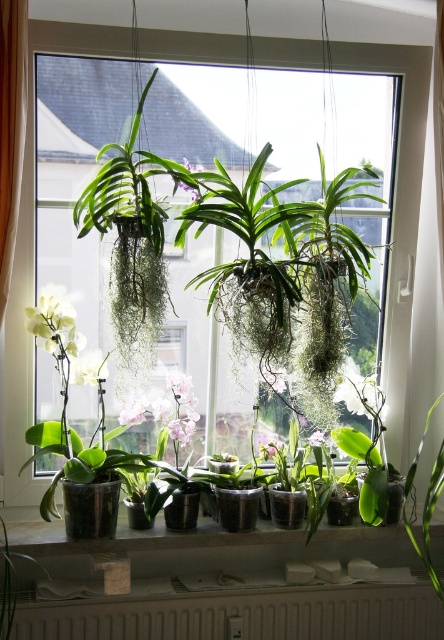
Question: Does white plastic radiator at lower center lie in front of white matte orchid at center?

Choices:
 (A) yes
 (B) no

Answer: (A)

Question: Does matte concrete window sill at lower center have a larger size compared to white matte orchid at center?

Choices:
 (A) yes
 (B) no

Answer: (A)

Question: Which point is closer to the camera taking this photo?

Choices:
 (A) (237, 596)
 (B) (63, 253)

Answer: (A)

Question: Which point is farther from the camera taking this photo?

Choices:
 (A) (380, 536)
 (B) (198, 172)
 (C) (12, 38)

Answer: (A)

Question: Can you confirm if transparent glass window at center is bigger than pink matte orchid at center?

Choices:
 (A) no
 (B) yes

Answer: (B)

Question: Estimate the real-world distances between objects in this image. Which object is farther from the pink matte orchid at center?

Choices:
 (A) white matte orchid at center
 (B) transparent glass window at center
 (C) purple matte orchid at center
 (D) white fabric curtain at left

Answer: (C)